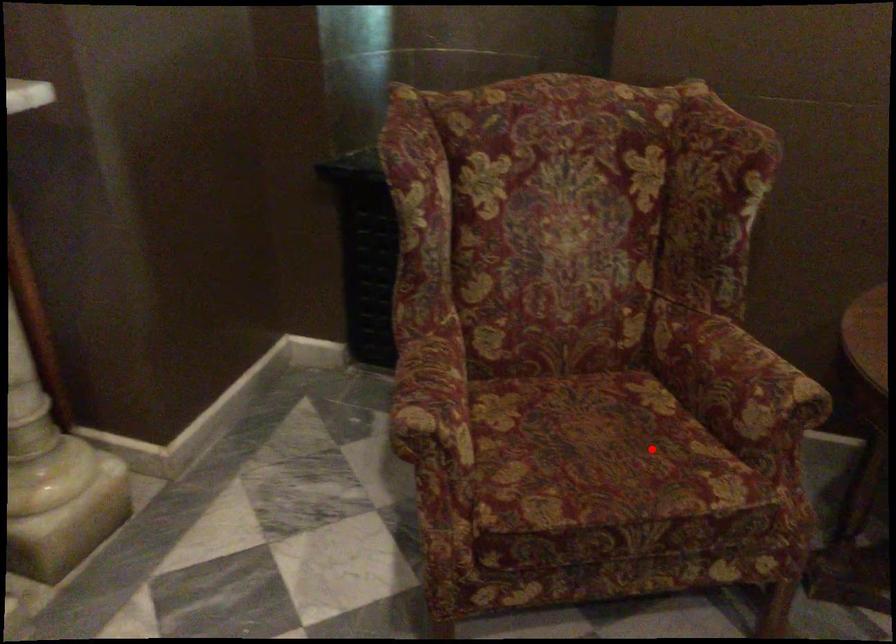
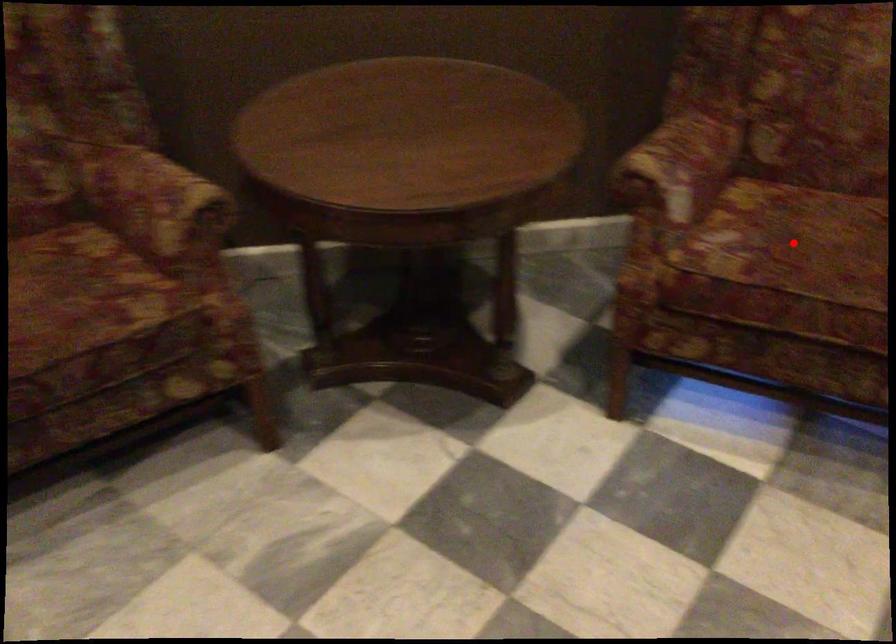
I am providing you with two images of the same scene from different viewpoints. A red point is marked on the first image and another point is marked on the second image. Is the marked point in image1 the same physical position as the marked point in image2?

No